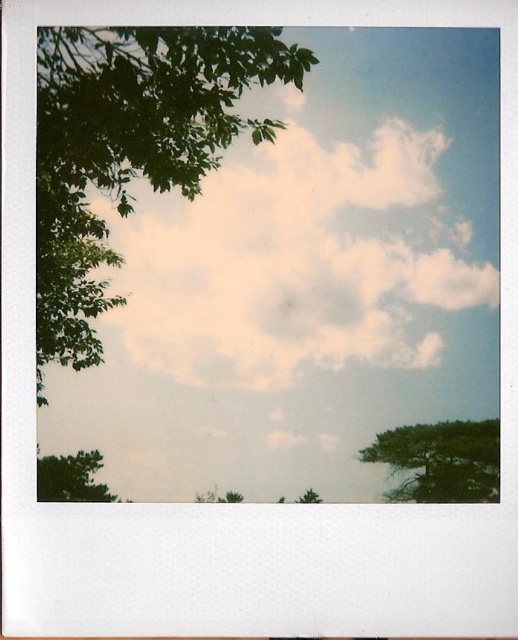
Question: Does green matte tree at lower right appear on the right side of green matte tree at lower left?

Choices:
 (A) yes
 (B) no

Answer: (A)

Question: Can you confirm if white fluffy cloud at upper center is wider than green leafy tree at upper left?

Choices:
 (A) no
 (B) yes

Answer: (B)

Question: Is white fluffy cloud at upper center smaller than green matte tree at lower right?

Choices:
 (A) no
 (B) yes

Answer: (A)

Question: Which object is positioned closest to the white fluffy cloud at upper center?

Choices:
 (A) green leafy tree at lower center
 (B) green matte tree at lower right
 (C) green matte tree at lower left

Answer: (B)

Question: Which of these objects is positioned closest to the green leafy tree at upper left?

Choices:
 (A) green leafy tree at lower center
 (B) green matte tree at lower left
 (C) green matte tree at lower right
 (D) white fluffy cloud at upper center

Answer: (D)

Question: Which point is farther from the camera taking this photo?

Choices:
 (A) (75, 480)
 (B) (310, 493)
 (C) (363, 195)

Answer: (C)